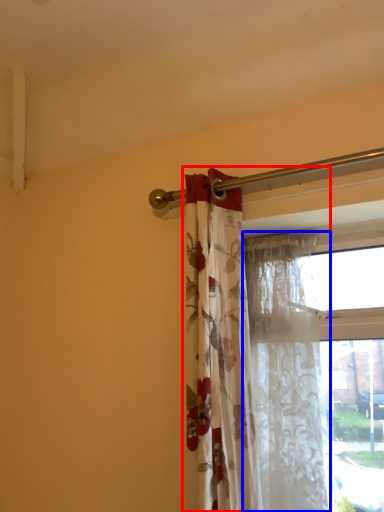
Question: Which object appears closest to the camera in this image, curtain (highlighted by a red box) or curtain (highlighted by a blue box)?

Choices:
 (A) curtain
 (B) curtain

Answer: (A)